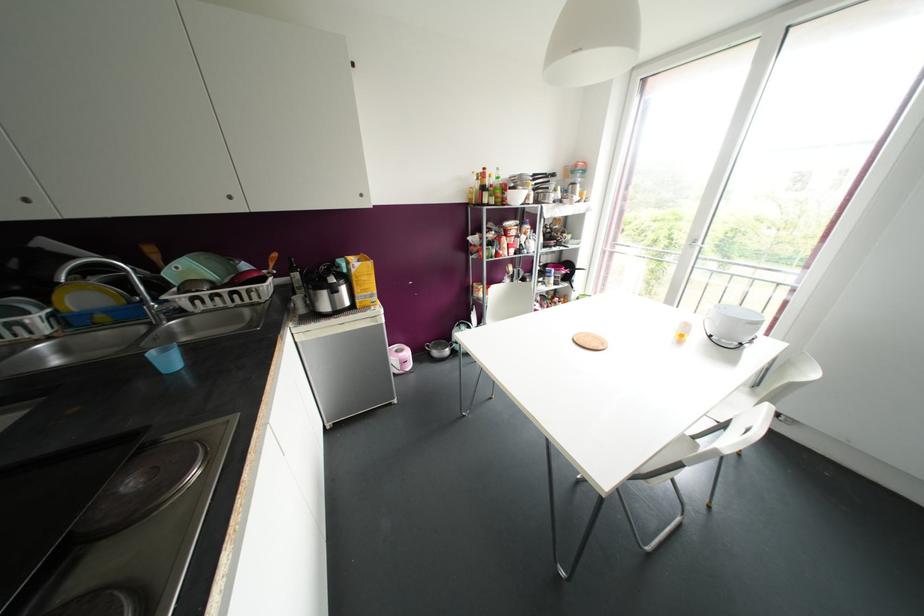
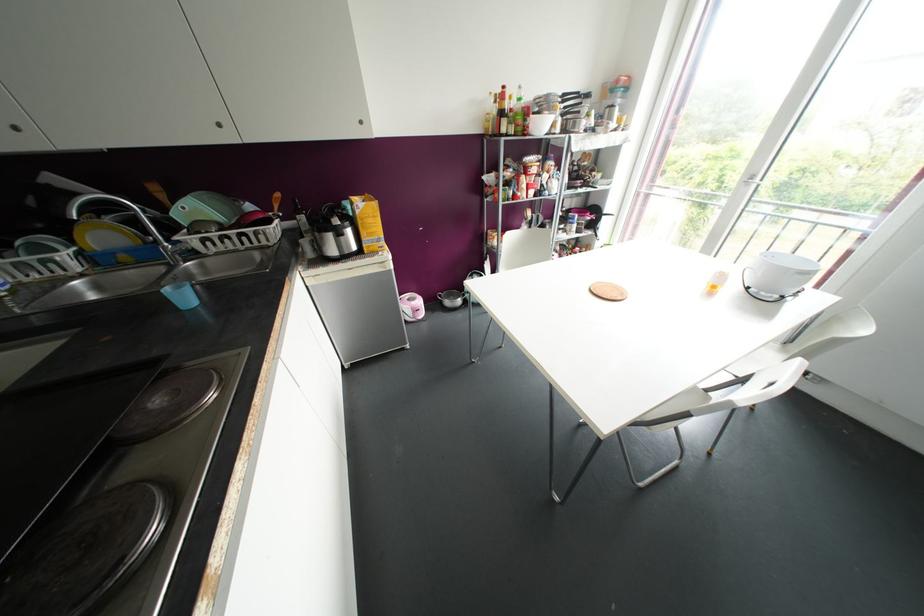
The point at (228, 197) is marked in the first image. Where is the corresponding point in the second image?

(219, 124)